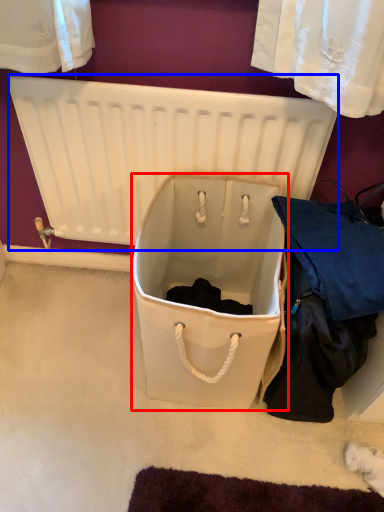
Question: Which point is closer to the camera, storage box (highlighted by a red box) or radiator (highlighted by a blue box)?

Choices:
 (A) storage box
 (B) radiator

Answer: (A)